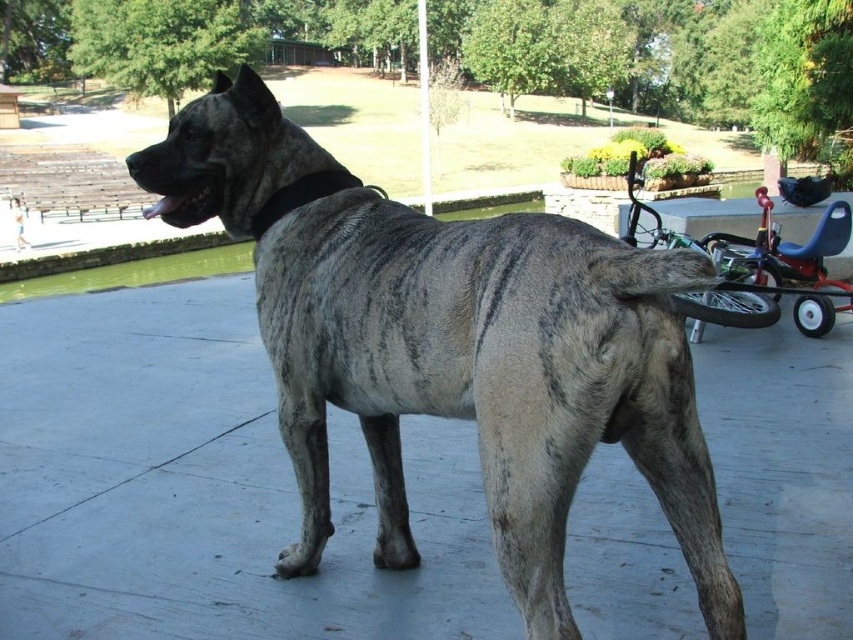
Looking at this image, can you confirm if brindle fur dog at center is positioned above metallic blue baby carriage at right?

Actually, brindle fur dog at center is below metallic blue baby carriage at right.

Who is higher up, brindle fur dog at center or metallic blue baby carriage at right?

metallic blue baby carriage at right

Image resolution: width=853 pixels, height=640 pixels. Describe the element at coordinates (453, 346) in the screenshot. I see `brindle fur dog at center` at that location.

You are a GUI agent. You are given a task and a screenshot of the screen. Output one action in this format:
    pyautogui.click(x=<x>, y=<y>)
    Task: Click on the brindle fur dog at center
    The width and height of the screenshot is (853, 640).
    Given the screenshot: What is the action you would take?
    pyautogui.click(x=453, y=346)